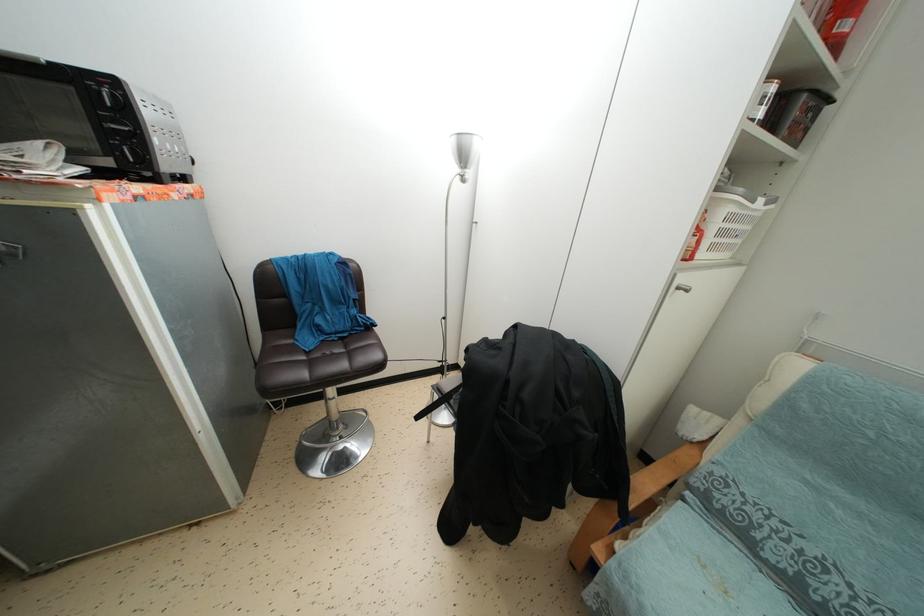
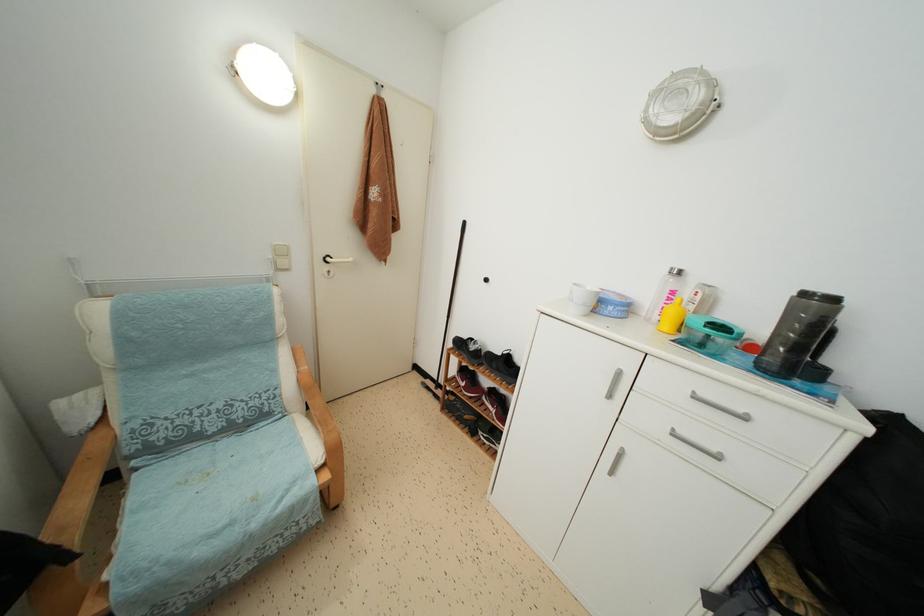
The first image is from the beginning of the video and the second image is from the end. How did the camera likely rotate when shooting the video?

The rotation direction of the camera is right-down.